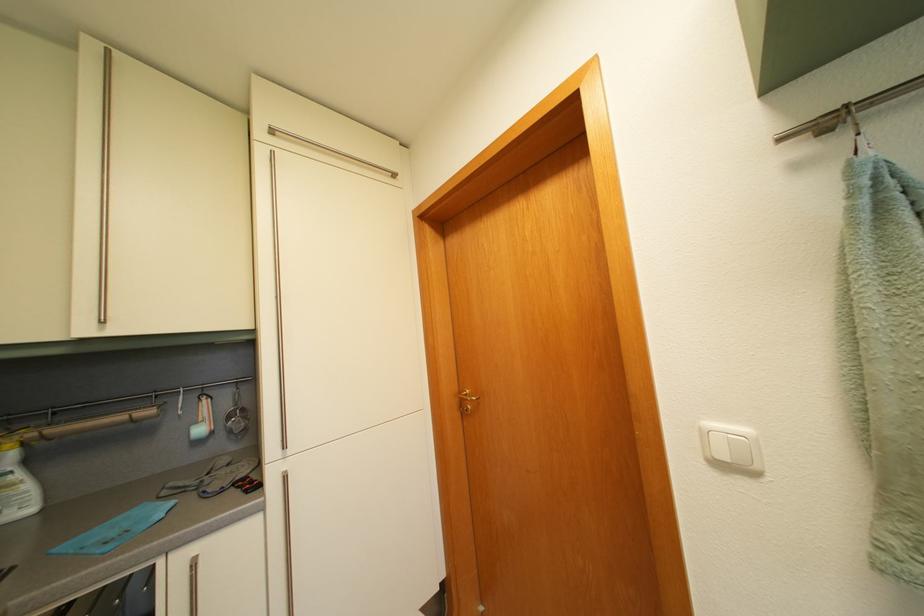
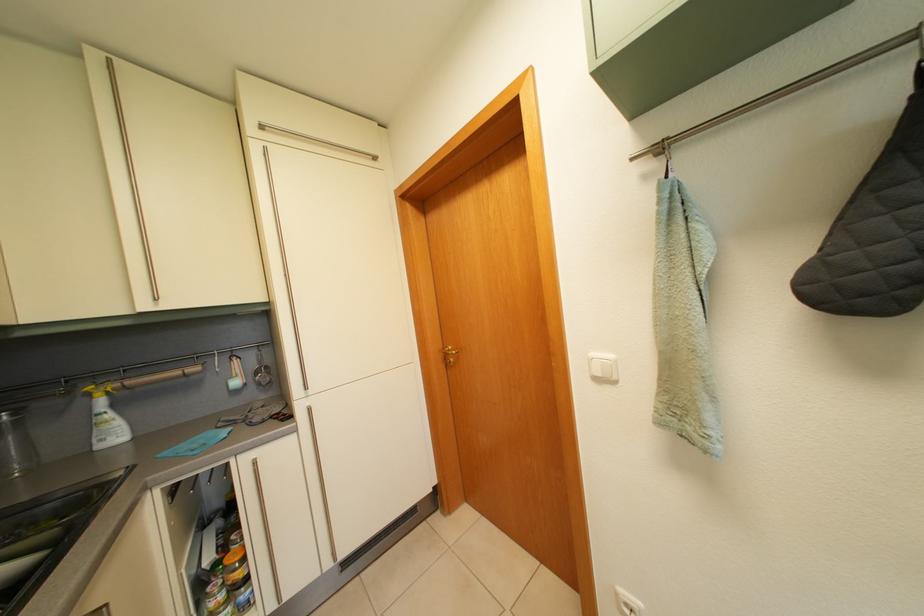
The images are taken continuously from a first-person perspective. In which direction are you moving?

The movement direction of the cameraman is right, backward.